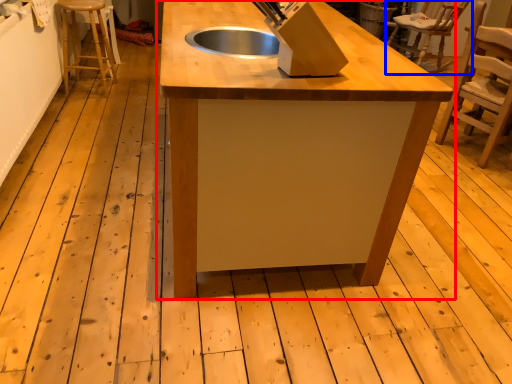
Question: Which point is further to the camera, table (highlighted by a red box) or chair (highlighted by a blue box)?

Choices:
 (A) table
 (B) chair

Answer: (B)